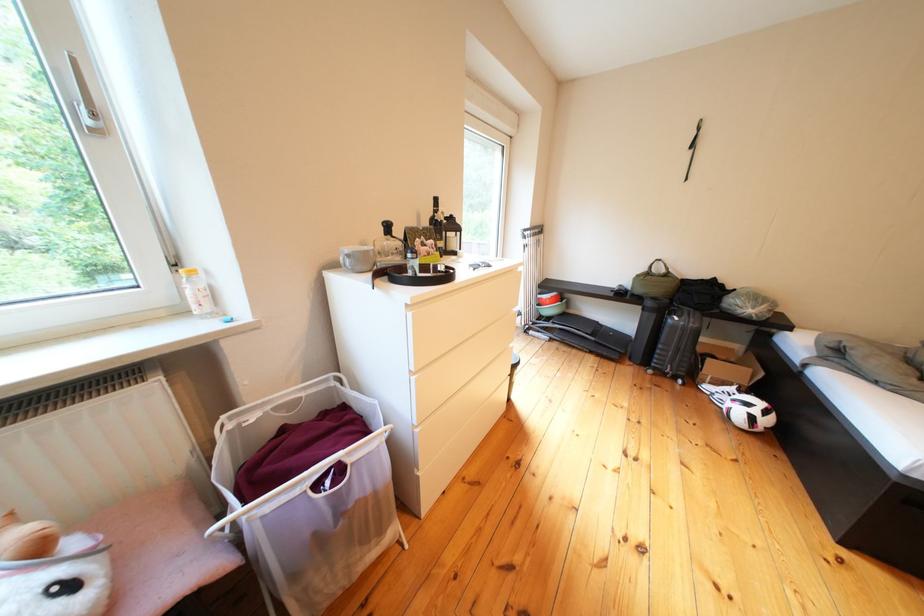
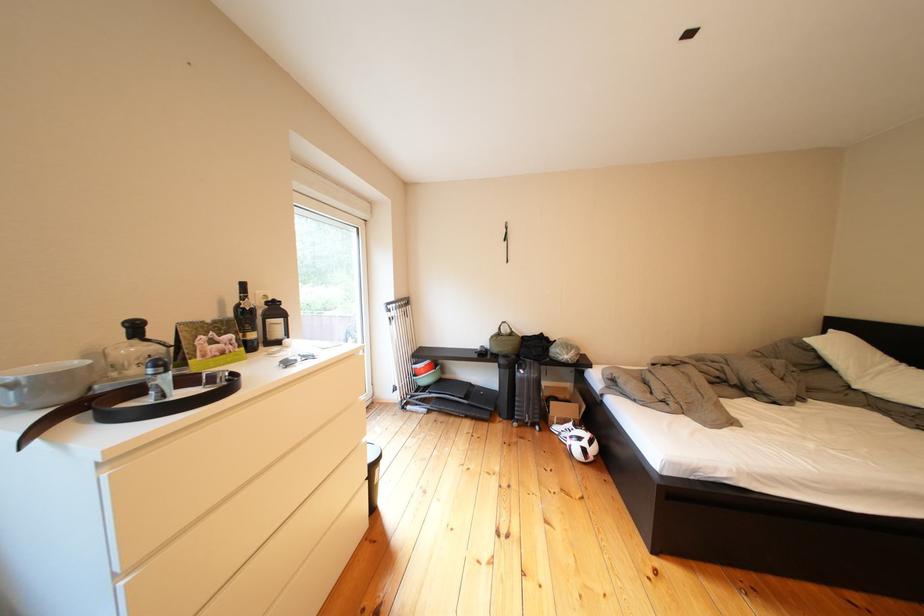
The point at (663, 308) is marked in the first image. Where is the corresponding point in the second image?

(516, 366)